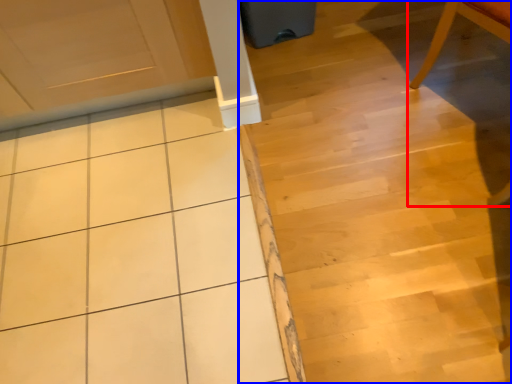
Question: Which object is further to the camera taking this photo, chair (highlighted by a red box) or stair (highlighted by a blue box)?

Choices:
 (A) chair
 (B) stair

Answer: (B)